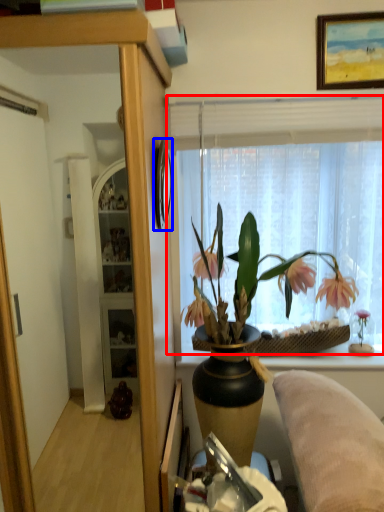
Question: Which of the following is the closest to the observer, window (highlighted by a red box) or picture frame (highlighted by a blue box)?

Choices:
 (A) window
 (B) picture frame

Answer: (B)